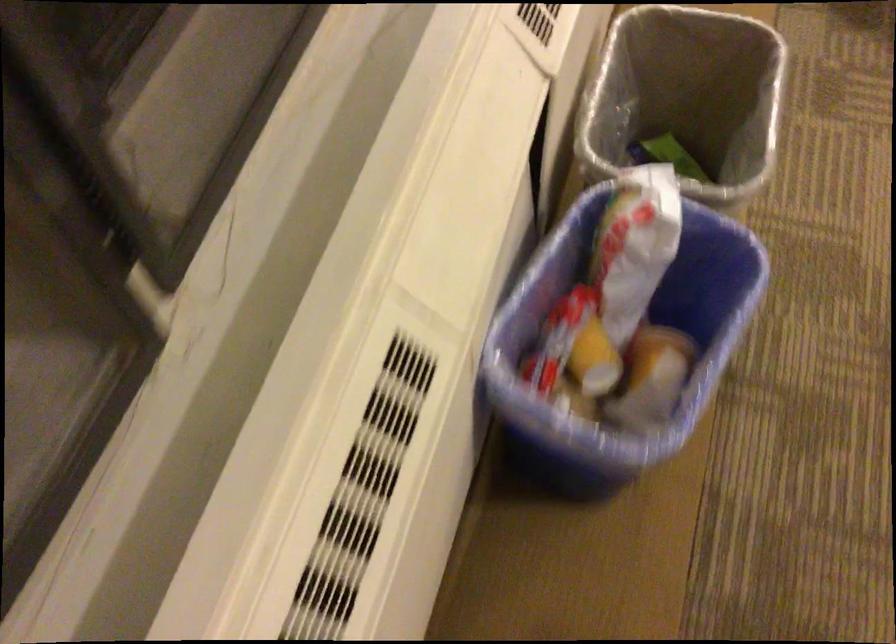
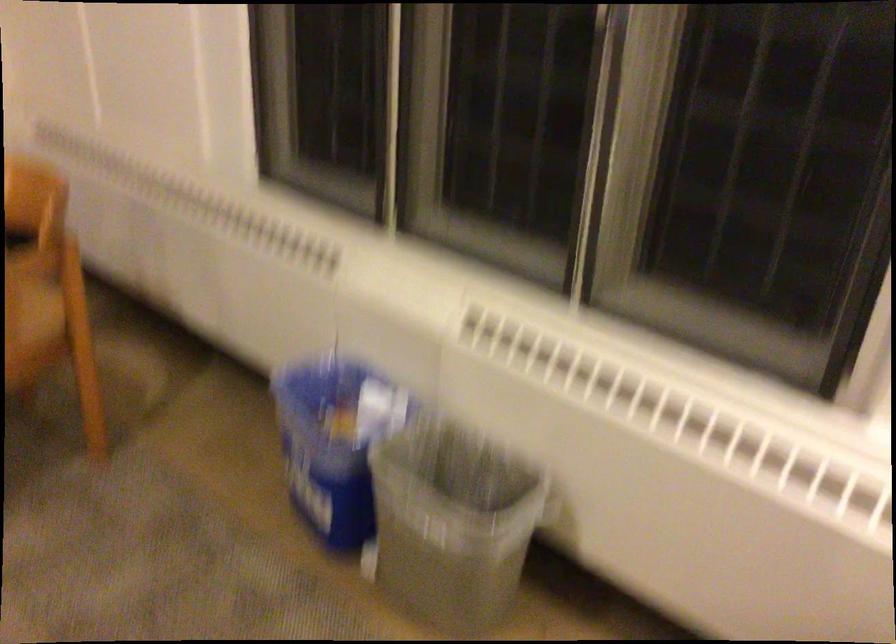
Find the pixel in the second image that matches pixel 736 238 in the first image.

(334, 442)